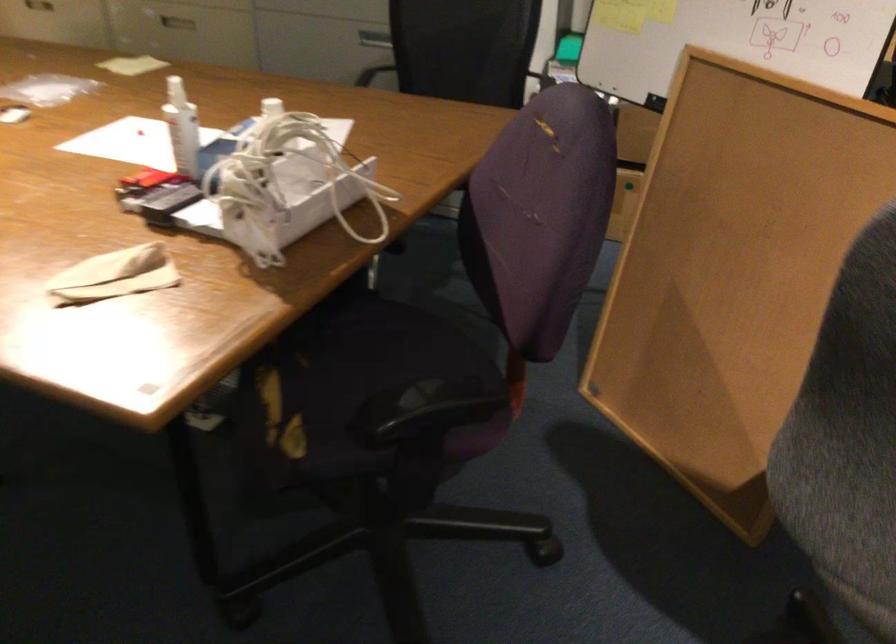
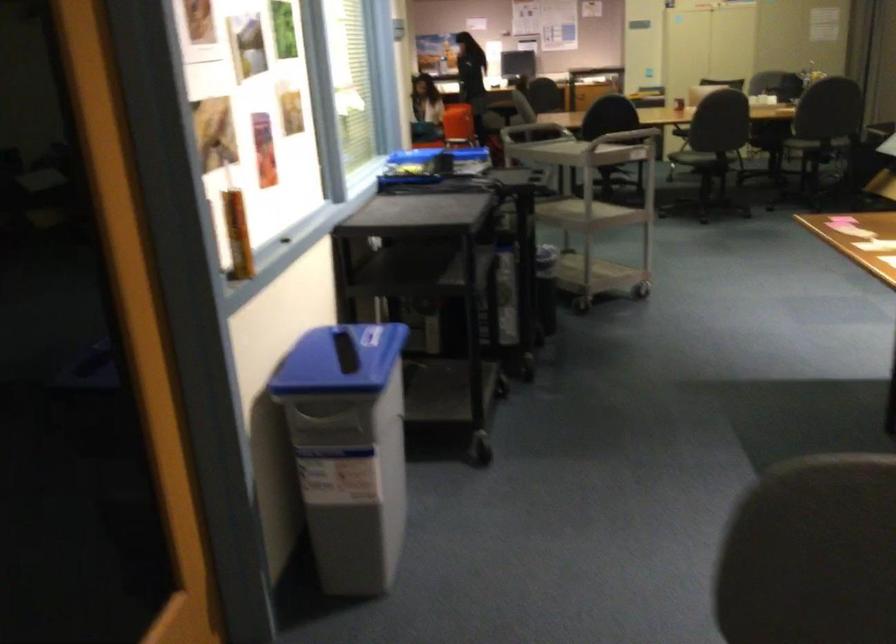
Question: The first image is from the beginning of the video and the second image is from the end. How did the camera likely rotate when shooting the video?

Choices:
 (A) Left
 (B) Right
 (C) Up
 (D) Down

Answer: (A)